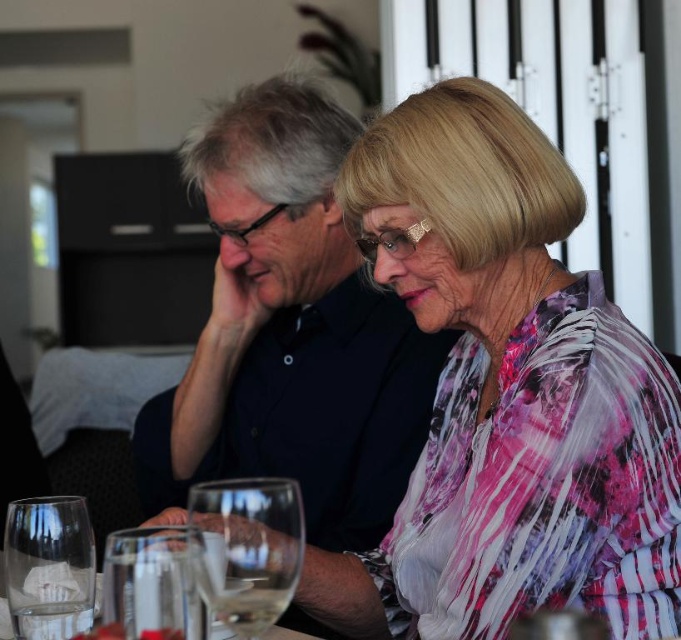
Can you confirm if pink floral blouse at center is thinner than transparent glass at lower left?

No.

Between pink floral blouse at center and transparent glass at lower left, which one is positioned higher?

pink floral blouse at center

Between point (569, 387) and point (44, 547), which one is positioned in front?

Point (44, 547)

Identify the location of pink floral blouse at center. The width and height of the screenshot is (681, 640). [513, 385].

Is transparent glass at lower center taller than transparent glass at lower left?

Incorrect, transparent glass at lower center's height is not larger of transparent glass at lower left's.

Which is behind, point (244, 484) or point (7, 525)?

The point (7, 525) is more distant.

Find the location of a particular element. transparent glass at lower center is located at coordinates (249, 548).

Which is behind, point (398, 321) or point (123, 628)?

The point (398, 321) is more distant.

Who is positioned more to the left, dark blue shirt at center or clear glass wine glass at lower left?

From the viewer's perspective, dark blue shirt at center appears more on the left side.

Does point (232, 100) lie behind point (176, 609)?

That is True.

Identify the location of dark blue shirt at center. (294, 348).